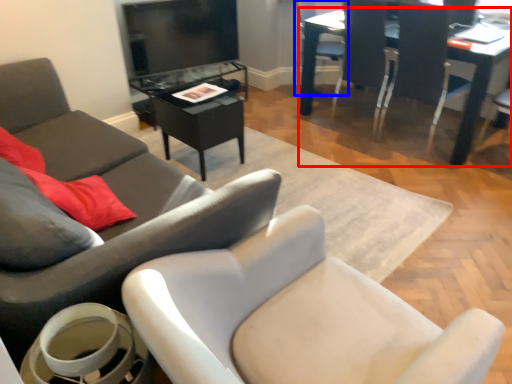
Question: Which point is further to the camera, table (highlighted by a red box) or chair (highlighted by a blue box)?

Choices:
 (A) table
 (B) chair

Answer: (B)